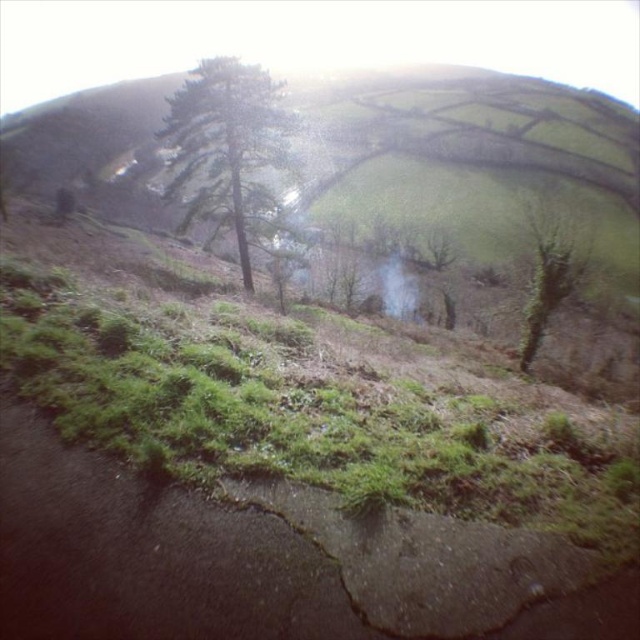
You are a hiker who wants to take a photo of both the green matte tree at upper center and the green rough bark tree at right in the same frame. Given the camera you have can only focus on objects within a vertical distance of 3 meters, will you be able to capture both trees in one shot?

The green matte tree at upper center is located above the green rough bark tree at right. Since the vertical distance between them is not specified, but the camera can focus within 3 meters vertically, it depends on their actual separation. However, based on the information provided, we cannot determine if they are within the 3 meter range.

You are a hiker who wants to take a photo of the green rough bark tree at right and the green grassy hillside at center. Which one should you move closer to in order to get both subjects in the frame without cropping?

The green grassy hillside at center is taller than the green rough bark tree at right, so you should move closer to the green grassy hillside at center to ensure both subjects fit within the frame.